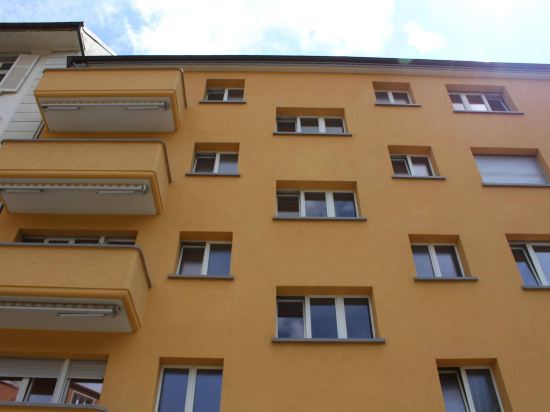
Identify the location of flourescent light fixtures. (46, 309), (76, 185), (94, 102).